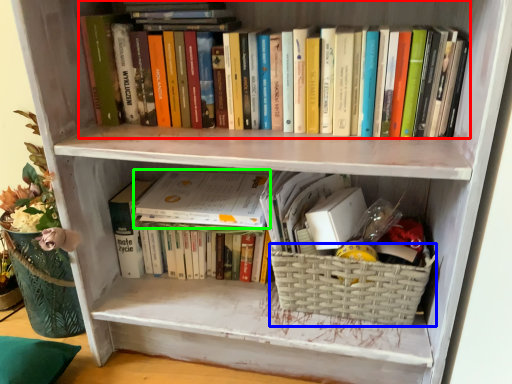
Question: Which is nearer to the book (highlighted by a red box)? basket (highlighted by a blue box) or paperback book (highlighted by a green box).

Choices:
 (A) basket
 (B) paperback book

Answer: (B)